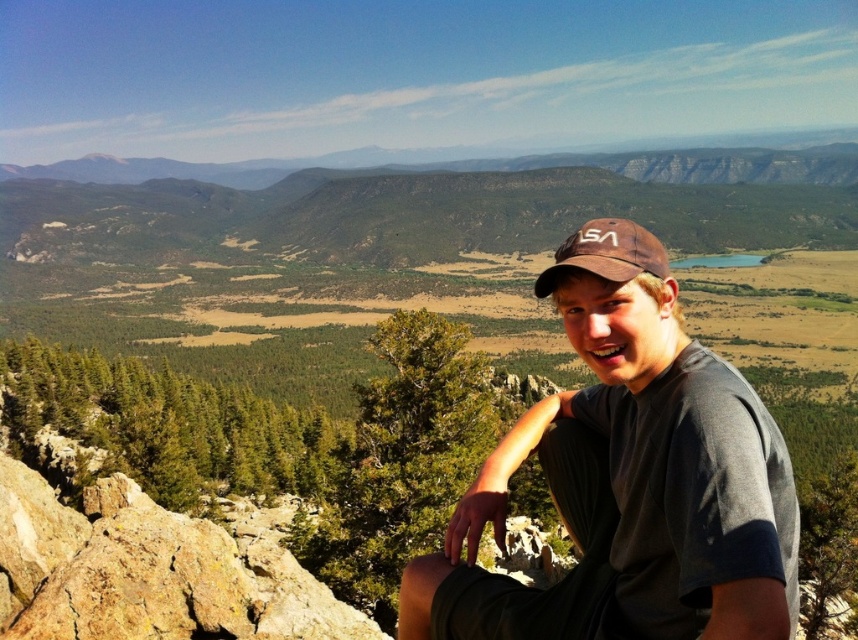
Question: Is dark gray t-shirt at center in front of brown fabric cap at center?

Choices:
 (A) yes
 (B) no

Answer: (A)

Question: Is dark gray t-shirt at center positioned in front of brown fabric cap at center?

Choices:
 (A) no
 (B) yes

Answer: (B)

Question: Does dark gray t-shirt at center have a lesser width compared to brown fabric cap at center?

Choices:
 (A) yes
 (B) no

Answer: (B)